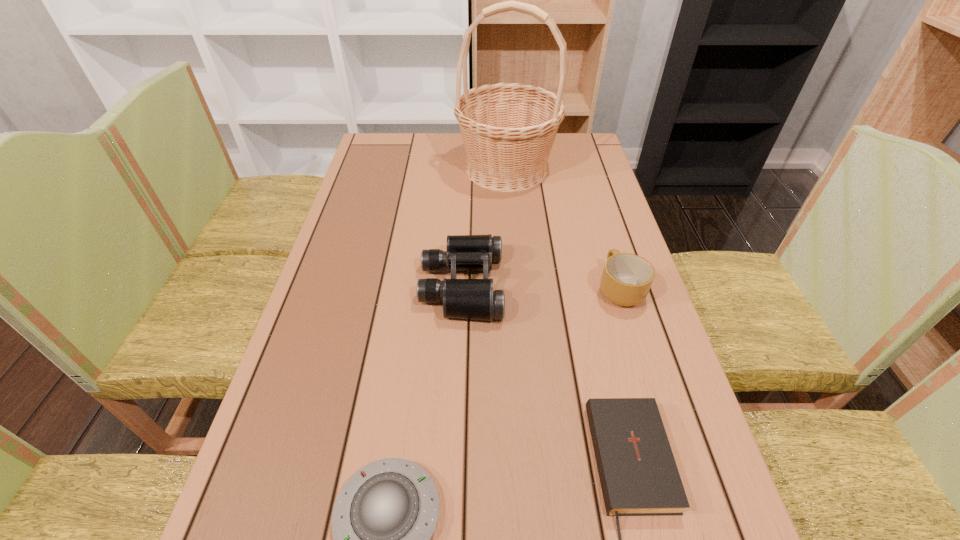
Locate an element on the screen. basket located in the right edge section of the desktop is located at coordinates (508, 129).

At what (x,y) coordinates should I click in order to perform the action: click on mug located in the right edge section of the desktop. Please return your answer as a coordinate pair (x, y). The image size is (960, 540). Looking at the image, I should click on (626, 279).

Identify the location of object present at the far right corner. [x=508, y=129].

In order to click on blank space at the far edge of the desktop in this screenshot , I will do `click(430, 140)`.

Identify the location of vacant space at the left edge. (377, 271).

This screenshot has height=540, width=960. Identify the location of vacant space at the right edge of the desktop. (618, 249).

Identify the location of blank region between the binoculars and the farthest object. (484, 227).

Where is `object that is the second closest to the shortest object`? The height and width of the screenshot is (540, 960). object that is the second closest to the shortest object is located at coordinates (474, 299).

Find the location of a particular element. This screenshot has height=540, width=960. object that is the third closest to the fourth tallest object is located at coordinates (626, 279).

Identify the location of vacant space that satisfies the following two spatial constraints: 1. on the side with the handle of the mug; 2. on the front-facing side of the fourth shortest object. The height and width of the screenshot is (540, 960). (618, 285).